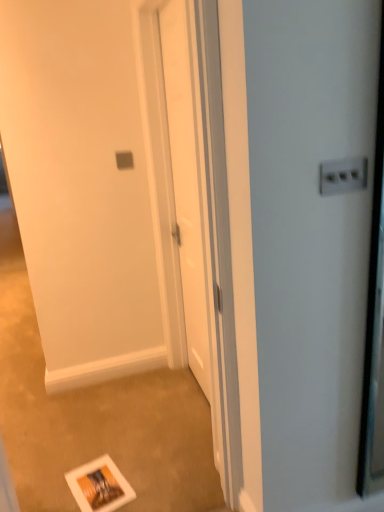
Question: Is white plastic electric outlet at upper right taller or shorter than white glossy door at center, positioned as the 2th screen door in front-to-back order?

Choices:
 (A) tall
 (B) short

Answer: (B)

Question: Is white plastic electric outlet at upper right wider or thinner than white glossy door at center, which is the 1th screen door in back-to-front order?

Choices:
 (A) thin
 (B) wide

Answer: (A)

Question: Estimate the real-world distances between objects in this image. Which object is farther from the white plastic electric outlet at upper right?

Choices:
 (A) white matte postcard at lower center
 (B) white glossy door at center, which is the 1th screen door in back-to-front order
 (C) white glossy screen door at lower center, the 2th screen door in the back-to-front sequence

Answer: (C)

Question: Which is farther from the white plastic electric outlet at upper right?

Choices:
 (A) white glossy door at center, which is the 1th screen door in back-to-front order
 (B) white glossy screen door at lower center, the 2th screen door in the back-to-front sequence
 (C) white matte postcard at lower center

Answer: (B)